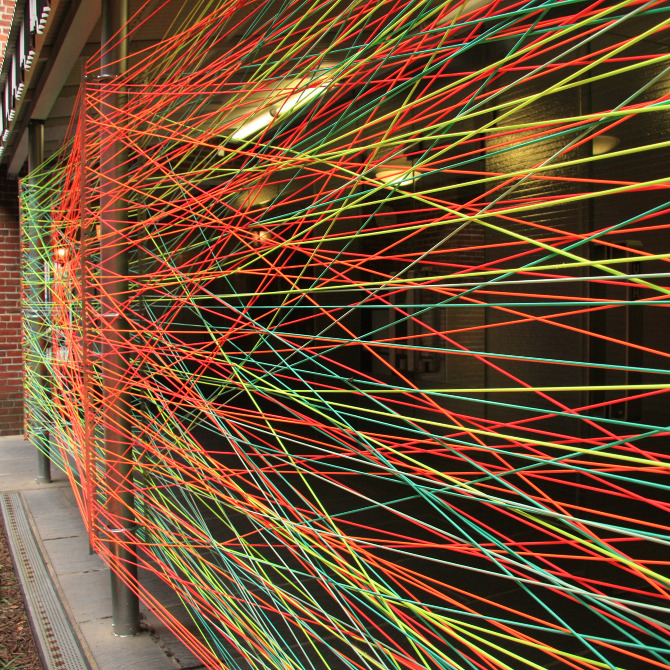
Locate an element on the screen. The image size is (670, 670). pillar supports is located at coordinates (120, 46), (117, 119), (117, 187), (113, 254), (113, 350), (113, 433), (121, 500), (121, 577).